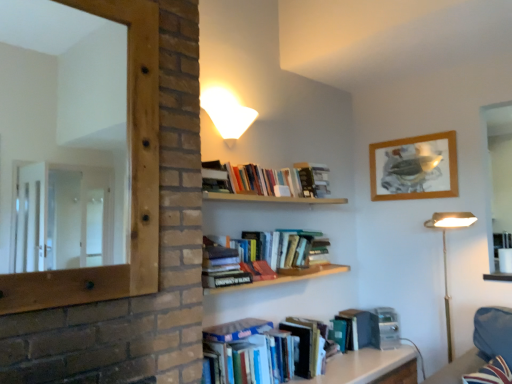
Question: Can you confirm if hardcover books at upper center, which ranks as the first book in top-to-bottom order, is thinner than wooden mirror at left?

Choices:
 (A) no
 (B) yes

Answer: (A)

Question: Considering the relative positions of hardcover books at upper center, which ranks as the first book in top-to-bottom order, and wooden mirror at left in the image provided, is hardcover books at upper center, which ranks as the first book in top-to-bottom order, behind wooden mirror at left?

Choices:
 (A) no
 (B) yes

Answer: (B)

Question: From a real-world perspective, is hardcover books at upper center, the 2th book when ordered from bottom to top, over wooden mirror at left?

Choices:
 (A) no
 (B) yes

Answer: (A)

Question: Would you say hardcover books at upper center, the 2th book when ordered from bottom to top, contains wooden mirror at left?

Choices:
 (A) no
 (B) yes

Answer: (A)

Question: Is hardcover books at upper center, the 2th book when ordered from bottom to top, facing away from wooden mirror at left?

Choices:
 (A) yes
 (B) no

Answer: (B)

Question: Is hardcover books at upper center, which ranks as the first book in top-to-bottom order, shorter than wooden mirror at left?

Choices:
 (A) yes
 (B) no

Answer: (A)

Question: Considering the relative sizes of white glossy wall lamp at upper center and green matte paperback book at lower center, the first paperback book from the right, in the image provided, is white glossy wall lamp at upper center shorter than green matte paperback book at lower center, the first paperback book from the right,?

Choices:
 (A) no
 (B) yes

Answer: (B)

Question: Can you confirm if white glossy wall lamp at upper center is positioned to the right of green matte paperback book at lower center, arranged as the 1th paperback book when ordered from the bottom?

Choices:
 (A) yes
 (B) no

Answer: (B)

Question: Is white glossy wall lamp at upper center positioned far away from green matte paperback book at lower center, positioned as the second paperback book in left-to-right order?

Choices:
 (A) yes
 (B) no

Answer: (A)

Question: Considering the relative sizes of white glossy wall lamp at upper center and green matte paperback book at lower center, the first paperback book from the right, in the image provided, is white glossy wall lamp at upper center thinner than green matte paperback book at lower center, the first paperback book from the right,?

Choices:
 (A) no
 (B) yes

Answer: (A)

Question: Would you say green matte paperback book at lower center, arranged as the 1th paperback book when ordered from the bottom, is part of white glossy wall lamp at upper center's contents?

Choices:
 (A) yes
 (B) no

Answer: (B)

Question: From the image's perspective, is white glossy wall lamp at upper center above green matte paperback book at lower center, the first paperback book from the right?

Choices:
 (A) no
 (B) yes

Answer: (B)

Question: Is gold metallic floor lamp at right beside hardcover books at upper center, the 2th book when ordered from bottom to top?

Choices:
 (A) no
 (B) yes

Answer: (A)